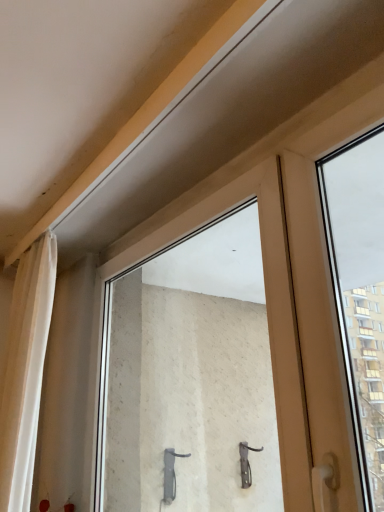
Image resolution: width=384 pixels, height=512 pixels. Identify the location of free space above transparent glass window at center (from a real-world perspective). (202, 189).